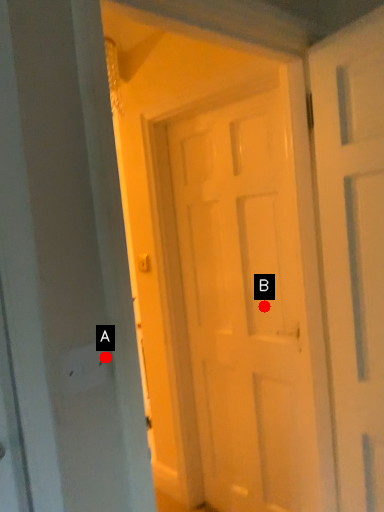
Question: Two points are circled on the image, labeled by A and B beside each circle. Which point is closer to the camera?

Choices:
 (A) A is closer
 (B) B is closer

Answer: (A)